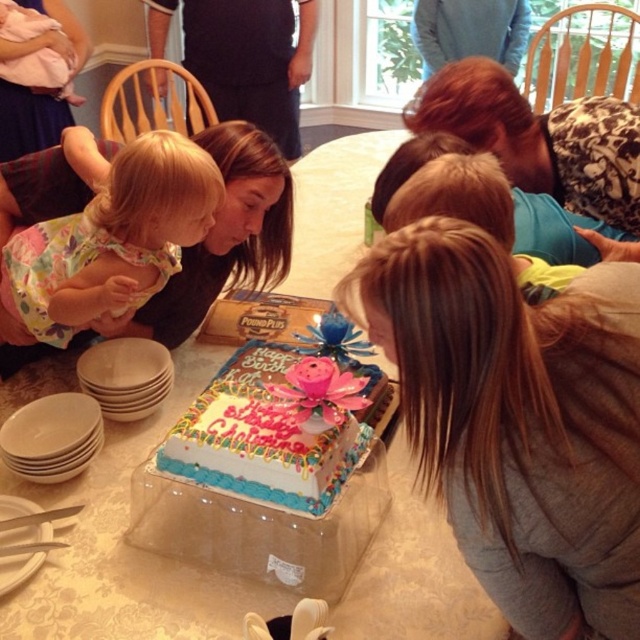
You are a guest at the birthday party and you want to take a photo of the decorative frosted cake at center without any obstruction. However, there is a brown textured sweater at center in the way. Based on their positions, can you move the sweater to the side to get an unobstructed view?

The brown textured sweater at center is above the decorative frosted cake at center, so moving the sweater down would allow you to take a clear photo of the cake without obstruction.

You are a photographer at a birthday party and need to capture a closeup of both the brown textured sweater at center and the leopard print shirt at center in the same frame. The camera you are using has a maximum focus range of 25 inches. Can you fit both items in the frame without moving the camera?

The brown textured sweater at center and leopard print shirt at center are 25.92 inches apart. Since the distance between them exceeds the camera maximum focus range of 25 inches, you cannot fit both items in the frame without moving the camera.